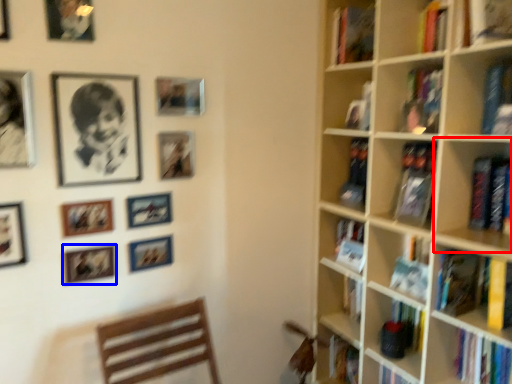
Question: Which of the following is the farthest to the observer, shelf (highlighted by a red box) or picture frame (highlighted by a blue box)?

Choices:
 (A) shelf
 (B) picture frame

Answer: (B)